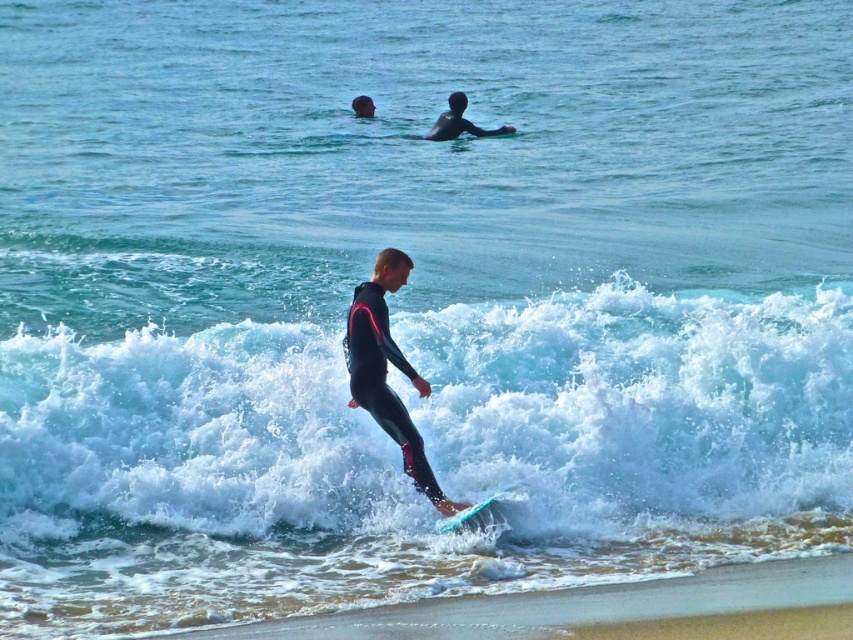
You are a beachgoer trying to decide where to place your beach umbrella. You see the white foamy wave at center and the smooth sand at lower center. Which location is taller?

The smooth sand at lower center is taller than the white foamy wave at center.

You are a photographer on the beach and want to capture a photo of both the black matte wetsuit at center and the black matte wetsuit at upper center in the same frame. Based on their positions, which direction should you move to ensure both are visible?

The black matte wetsuit at center is to the left of the black matte wetsuit at upper center. To capture both in the same frame, you should move to the right side so that both are visible in your camera view.